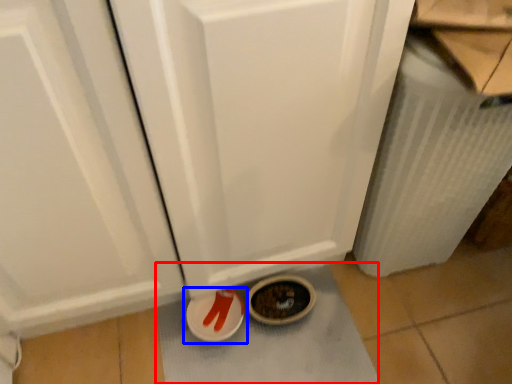
Question: Which point is further to the camera, bath mat (highlighted by a red box) or footwear (highlighted by a blue box)?

Choices:
 (A) bath mat
 (B) footwear

Answer: (B)